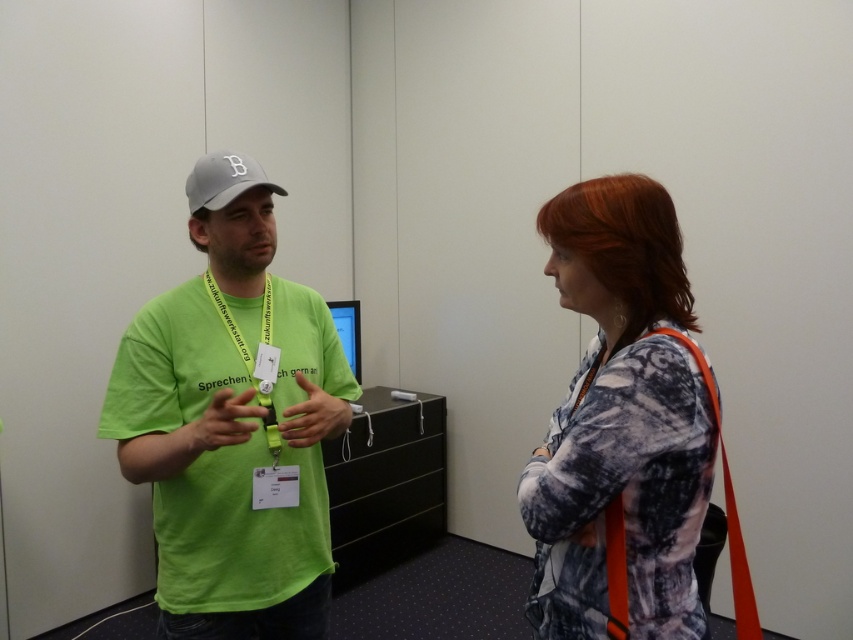
Question: Among these objects, which one is farthest from the camera?

Choices:
 (A) green matte t-shirt at center
 (B) gray fabric baseball cap at upper left
 (C) patterned fabric blouse at right

Answer: (B)

Question: Which object is farther from the camera taking this photo?

Choices:
 (A) green matte t-shirt at center
 (B) gray fabric baseball cap at upper left

Answer: (B)

Question: Can you confirm if patterned fabric blouse at right is positioned below gray fabric baseball cap at upper left?

Choices:
 (A) no
 (B) yes

Answer: (B)

Question: Does green matte t-shirt at center come behind gray fabric baseball cap at upper left?

Choices:
 (A) yes
 (B) no

Answer: (B)

Question: Is green matte t-shirt at center behind patterned fabric blouse at right?

Choices:
 (A) no
 (B) yes

Answer: (B)

Question: Which object is farther from the camera taking this photo?

Choices:
 (A) green matte t-shirt at center
 (B) patterned fabric blouse at right
 (C) gray fabric baseball cap at upper left

Answer: (C)